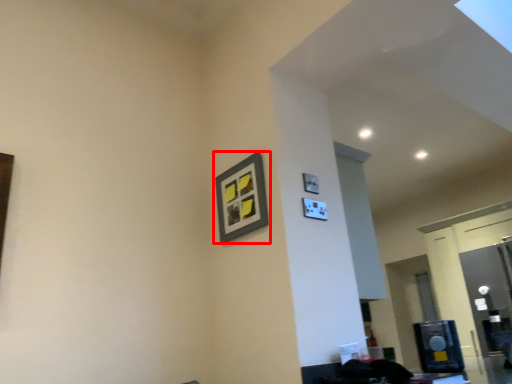
Question: From the image's perspective, where is picture frame (annotated by the red box) located relative to glass door?

Choices:
 (A) below
 (B) above

Answer: (B)